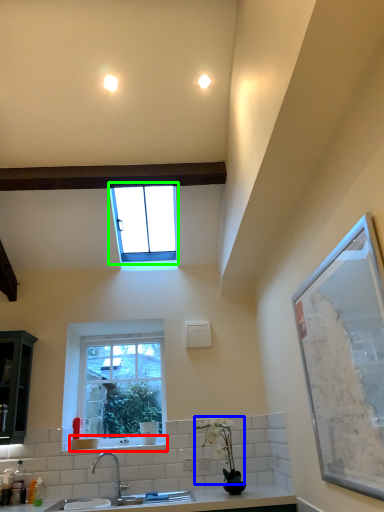
Question: Based on their relative distances, which object is farther from window sill (highlighted by a red box)? Choose from plant (highlighted by a blue box) and window (highlighted by a green box).

Choices:
 (A) plant
 (B) window

Answer: (B)